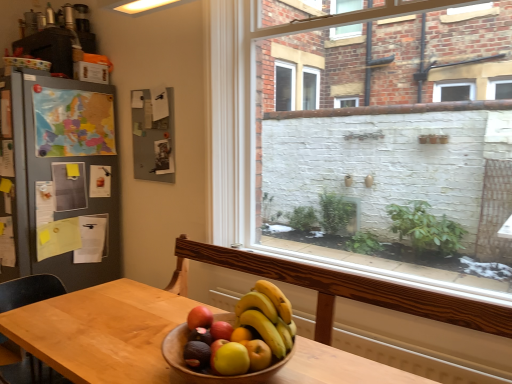
Image resolution: width=512 pixels, height=384 pixels. Find the location of `wooden table at center`. wooden table at center is located at coordinates (102, 332).

What is the approximate width of white brick wall at center?

white brick wall at center is 12.03 inches wide.

What is the approximate height of yellow matte bananas at center?

yellow matte bananas at center is 5.24 inches tall.

Find the location of a particular element. The height and width of the screenshot is (384, 512). matte black cabinet at upper left is located at coordinates (49, 48).

Where is `wooden table at center`? wooden table at center is located at coordinates (102, 332).

Is the depth of matte black cabinet at upper left greater than that of wooden table at center?

Yes, it is behind wooden table at center.

From a real-world perspective, which object rests below the other?

wooden table at center.

Locate an element on the screen. This screenshot has height=384, width=512. desk on the right of matte black cabinet at upper left is located at coordinates (x=102, y=332).

Considering the positions of objects matte black cabinet at upper left and wooden table at center in the image provided, who is more to the right, matte black cabinet at upper left or wooden table at center?

wooden table at center.

Is wooden table at center wider or thinner than white brick wall at center?

Clearly, wooden table at center has more width compared to white brick wall at center.

Where is `window above the wooden table at center (from a real-world perspective)`? window above the wooden table at center (from a real-world perspective) is located at coordinates (352, 153).

Between wooden table at center and white brick wall at center, which one appears on the left side from the viewer's perspective?

wooden table at center.

Which object is more forward, wooden table at center or white brick wall at center?

wooden table at center is closer to the camera.

Is wooden table at center inside the boundaries of yellow matte bananas at center, or outside?

wooden table at center lies outside yellow matte bananas at center.

Measure the distance between wooden table at center and yellow matte bananas at center.

A distance of 16.06 inches exists between wooden table at center and yellow matte bananas at center.

Does wooden table at center have a smaller size compared to yellow matte bananas at center?

Incorrect, wooden table at center is not smaller in size than yellow matte bananas at center.

Between point (118, 300) and point (288, 332), which one is positioned in front?

The point (288, 332) is closer.

From a real-world perspective, is red matte apple at center under yellow matte bananas at center?

Correct, in the physical world, red matte apple at center is lower than yellow matte bananas at center.

How different are the orientations of red matte apple at center and yellow matte bananas at center in degrees?

0.00208 degrees separate the facing orientations of red matte apple at center and yellow matte bananas at center.

Considering the relative sizes of red matte apple at center and yellow matte bananas at center in the image provided, is red matte apple at center bigger than yellow matte bananas at center?

Incorrect, red matte apple at center is not larger than yellow matte bananas at center.

Is red matte apple at center positioned with its back to yellow matte bananas at center?

red matte apple at center is not turned away from yellow matte bananas at center.

Does white brick wall at center have a lesser height compared to matte black cabinet at upper left?

No, white brick wall at center is not shorter than matte black cabinet at upper left.

The image size is (512, 384). Identify the location of cabinetry lying behind the white brick wall at center. (49, 48).

Considering the positions of points (279, 151) and (62, 38), is point (279, 151) farther from camera compared to point (62, 38)?

Yes.

Considering the positions of objects white brick wall at center and matte black cabinet at upper left in the image provided, who is more to the right, white brick wall at center or matte black cabinet at upper left?

From the viewer's perspective, white brick wall at center appears more on the right side.

In order to click on bowl that is on the right side of wooden table at center in this screenshot , I will do point(209,374).

From a real-world perspective, does wooden table at center sit lower than wooden bowl at center?

Yes, from a real-world perspective, wooden table at center is below wooden bowl at center.

Can you see wooden table at center touching wooden bowl at center?

No, wooden table at center is not making contact with wooden bowl at center.

From a real-world perspective, is wooden bowl at center physically located above or below yellow matte bananas at center?

wooden bowl at center is below yellow matte bananas at center.

Locate an element on the screen. The height and width of the screenshot is (384, 512). bowl below the yellow matte bananas at center (from the image's perspective) is located at coordinates (209, 374).

Which object is wider, wooden bowl at center or yellow matte bananas at center?

wooden bowl at center is wider.

Could you tell me if wooden bowl at center is turned towards yellow matte bananas at center?

No, wooden bowl at center is not aimed at yellow matte bananas at center.

This screenshot has width=512, height=384. I want to click on cabinetry that is above the wooden table at center (from the image's perspective), so click(49, 48).

In order to click on window behind the wooden table at center in this screenshot , I will do `click(352, 153)`.

Considering their positions, is white brick wall at center positioned further to yellow matte bananas at center than matte black cabinet at upper left?

matte black cabinet at upper left.

Considering their positions, is wooden bowl at center positioned closer to matte black cabinet at upper left than yellow matte bananas at center?

yellow matte bananas at center is closer to matte black cabinet at upper left.

Which object lies further to the anchor point wooden bowl at center, matte black cabinet at upper left or yellow matte bananas at center?

matte black cabinet at upper left is further to wooden bowl at center.

Which object lies nearer to the anchor point matte black cabinet at upper left, wooden table at center or wooden bowl at center?

Based on the image, wooden table at center appears to be nearer to matte black cabinet at upper left.

From the image, which object appears to be nearer to red matte apple at center, yellow matte bananas at center or wooden table at center?

yellow matte bananas at center.

Considering their positions, is yellow matte bananas at center positioned further to matte black cabinet at upper left than wooden bowl at center?

A: wooden bowl at center.

Which object lies nearer to the anchor point wooden table at center, yellow matte bananas at center or wooden bowl at center?

wooden bowl at center.

When comparing their distances from red matte apple at center, does yellow matte bananas at center or wooden bowl at center seem further?

Based on the image, yellow matte bananas at center appears to be further to red matte apple at center.

Where is `banana between wooden bowl at center and matte black cabinet at upper left along the z-axis`? The width and height of the screenshot is (512, 384). banana between wooden bowl at center and matte black cabinet at upper left along the z-axis is located at coordinates (268, 316).

You are a GUI agent. You are given a task and a screenshot of the screen. Output one action in this format:
    pyautogui.click(x=<x>, y=<y>)
    Task: Click on the banana between white brick wall at center and wooden bowl at center in the up-down direction
    The height and width of the screenshot is (384, 512).
    Given the screenshot: What is the action you would take?
    pyautogui.click(x=268, y=316)

The height and width of the screenshot is (384, 512). What are the coordinates of `apple between yellow matte bananas at center and matte black cabinet at upper left in the front-back direction` in the screenshot? It's located at tap(221, 330).

Find the location of a particular element. This screenshot has width=512, height=384. banana between matte black cabinet at upper left and white brick wall at center in the horizontal direction is located at coordinates (268, 316).